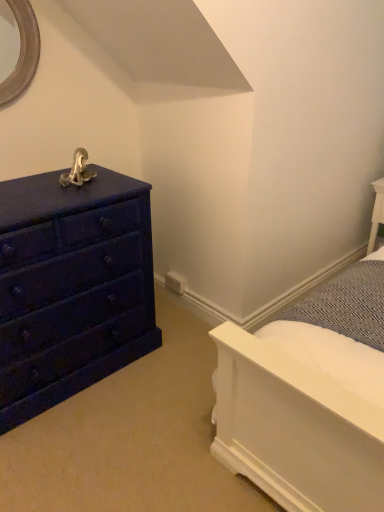
Question: In the image, is matte dark blue dresser at left positioned in front of or behind white textured fabric at upper right?

Choices:
 (A) behind
 (B) front

Answer: (B)

Question: Considering the positions of matte dark blue dresser at left and white textured fabric at upper right in the image, is matte dark blue dresser at left bigger or smaller than white textured fabric at upper right?

Choices:
 (A) big
 (B) small

Answer: (A)

Question: Is matte dark blue dresser at left taller or shorter than white textured fabric at upper right?

Choices:
 (A) short
 (B) tall

Answer: (B)

Question: From their relative heights in the image, would you say white textured fabric at upper right is taller or shorter than matte dark blue dresser at left?

Choices:
 (A) short
 (B) tall

Answer: (A)

Question: In the image, is white textured fabric at upper right positioned in front of or behind matte dark blue dresser at left?

Choices:
 (A) front
 (B) behind

Answer: (B)

Question: From the image's perspective, is white textured fabric at upper right positioned above or below matte dark blue dresser at left?

Choices:
 (A) below
 (B) above

Answer: (A)

Question: Considering the positions of point [349, 305] and point [67, 378], is point [349, 305] closer or farther from the camera than point [67, 378]?

Choices:
 (A) farther
 (B) closer

Answer: (B)